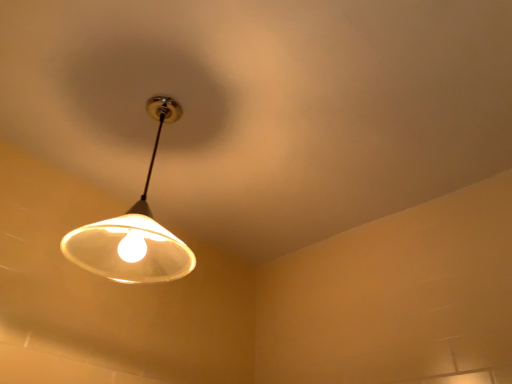
Based on the photo, measure the distance between matte white lampshade at upper left and camera.

A distance of 36.44 inches exists between matte white lampshade at upper left and camera.

Locate an element on the screen. This screenshot has width=512, height=384. matte white lampshade at upper left is located at coordinates (134, 231).

The height and width of the screenshot is (384, 512). Describe the element at coordinates (134, 231) in the screenshot. I see `matte white lampshade at upper left` at that location.

What are the coordinates of `matte white lampshade at upper left` in the screenshot? It's located at (134, 231).